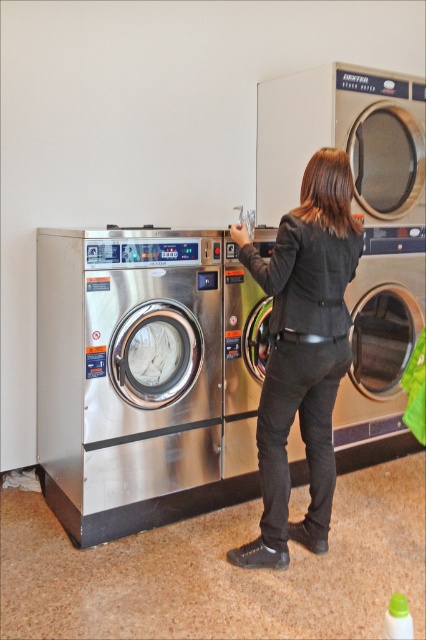
Who is higher up, black leather jacket at center or stainless steel washing machine at center?

black leather jacket at center is higher up.

Locate an element on the screen. black leather jacket at center is located at coordinates (302, 353).

Does stainless steel washing machine at left appear over black leather jacket at center?

Incorrect, stainless steel washing machine at left is not positioned above black leather jacket at center.

Can you confirm if stainless steel washing machine at left is positioned below black leather jacket at center?

Yes.

Which is in front, point (160, 304) or point (342, 259)?

Point (342, 259) is in front.

Where is `stainless steel washing machine at left`? stainless steel washing machine at left is located at coordinates (127, 378).

Is stainless steel washing machine at left positioned at the back of stainless steel washing machine at center?

No, stainless steel washing machine at left is closer to the viewer.

Does stainless steel washing machine at left lie in front of stainless steel washing machine at center?

Yes.

Which is in front, point (210, 372) or point (359, 291)?

Point (210, 372)

You are a GUI agent. You are given a task and a screenshot of the screen. Output one action in this format:
    pyautogui.click(x=<x>, y=<y>)
    Task: Click on the stainless steel washing machine at left
    This screenshot has height=640, width=426.
    Given the screenshot: What is the action you would take?
    pyautogui.click(x=127, y=378)